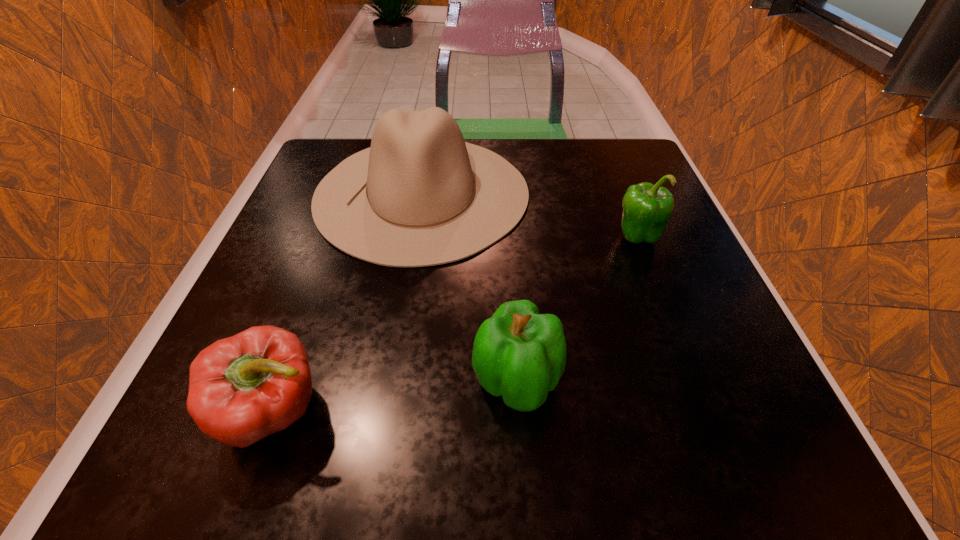
Find the location of a particular element. The width and height of the screenshot is (960, 540). object that is the third closest to the rightmost bell pepper is located at coordinates (243, 388).

Where is `object that is the second nearest to the sombrero`? object that is the second nearest to the sombrero is located at coordinates (519, 354).

Locate which bell pepper ranks in proximity to the sombrero. Please provide its 2D coordinates. Your answer should be formatted as a tuple, i.e. [(x, y)], where the tuple contains the x and y coordinates of a point satisfying the conditions above.

[(647, 208)]

Where is `bell pepper that is the second closest to the tallest object`? Image resolution: width=960 pixels, height=540 pixels. bell pepper that is the second closest to the tallest object is located at coordinates (519, 354).

You are a GUI agent. You are given a task and a screenshot of the screen. Output one action in this format:
    pyautogui.click(x=<x>, y=<y>)
    Task: Click on the vacant space that satisfies the following two spatial constraints: 1. on the back side of the rightmost bell pepper; 2. on the left side of the second bell pepper from left to right
    The image size is (960, 540).
    Given the screenshot: What is the action you would take?
    pyautogui.click(x=507, y=237)

The height and width of the screenshot is (540, 960). What are the coordinates of `vacant space that satisfies the following two spatial constraints: 1. on the back side of the second bell pepper from left to right; 2. on the right side of the farthest bell pepper` in the screenshot? It's located at point(507,237).

Identify the location of vacant point that satisfies the following two spatial constraints: 1. on the back side of the leftmost bell pepper; 2. on the right side of the second bell pepper from right to left. Image resolution: width=960 pixels, height=540 pixels. (285, 382).